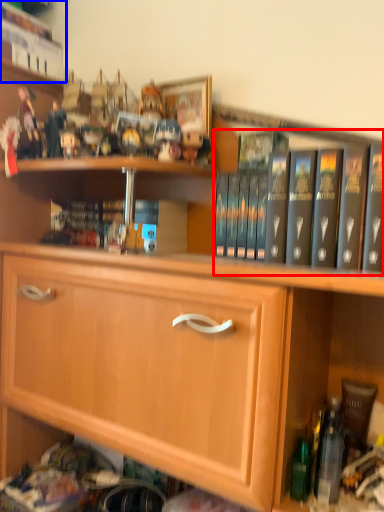
Question: Which object is further to the camera taking this photo, book (highlighted by a red box) or book (highlighted by a blue box)?

Choices:
 (A) book
 (B) book

Answer: (B)